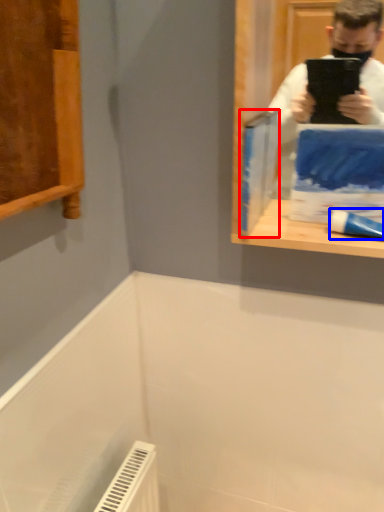
Question: Which of the following is the closest to the observer, paperback book (highlighted by a red box) or toothpaste (highlighted by a blue box)?

Choices:
 (A) paperback book
 (B) toothpaste

Answer: (B)